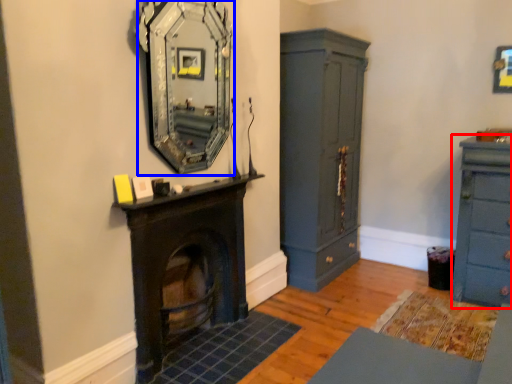
Question: Which point is further to the camera, chest of drawers (highlighted by a red box) or mirror (highlighted by a blue box)?

Choices:
 (A) chest of drawers
 (B) mirror

Answer: (A)